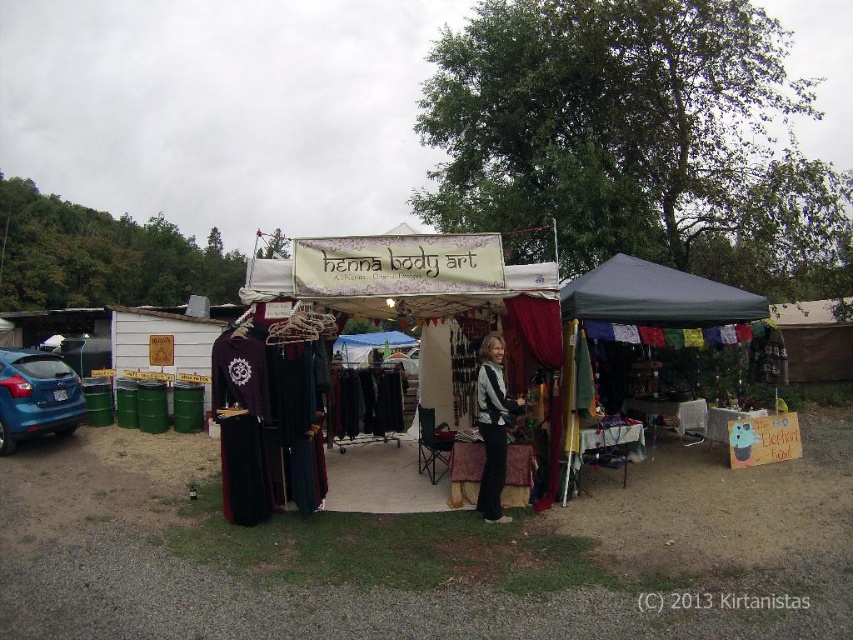
Between textured fabric stall at center and blue matte car at left, which one appears on the right side from the viewer's perspective?

textured fabric stall at center

Between point (381, 483) and point (33, 419), which one is positioned in front?

Point (381, 483)

The height and width of the screenshot is (640, 853). What are the coordinates of `textured fabric stall at center` in the screenshot? It's located at (380, 481).

Which is in front, point (753, 317) or point (595, 280)?

Point (753, 317) is more forward.

Which is more to the left, dark gray fabric tent at center or dark gray fabric canopy at center?

dark gray fabric tent at center

The image size is (853, 640). Describe the element at coordinates (654, 296) in the screenshot. I see `dark gray fabric tent at center` at that location.

Image resolution: width=853 pixels, height=640 pixels. I want to click on dark gray fabric tent at center, so click(654, 296).

Is dark gray fabric tent at center bigger than black velvet vest at center?

Yes, dark gray fabric tent at center is bigger than black velvet vest at center.

Does dark gray fabric tent at center have a greater height compared to black velvet vest at center?

Incorrect, dark gray fabric tent at center's height is not larger of black velvet vest at center's.

Where is `dark gray fabric tent at center`? dark gray fabric tent at center is located at coordinates (654, 296).